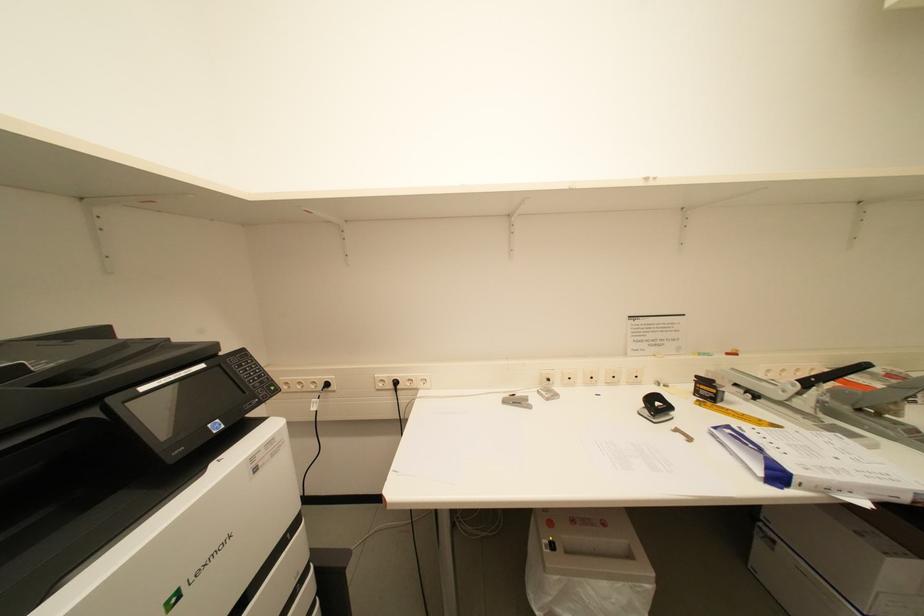
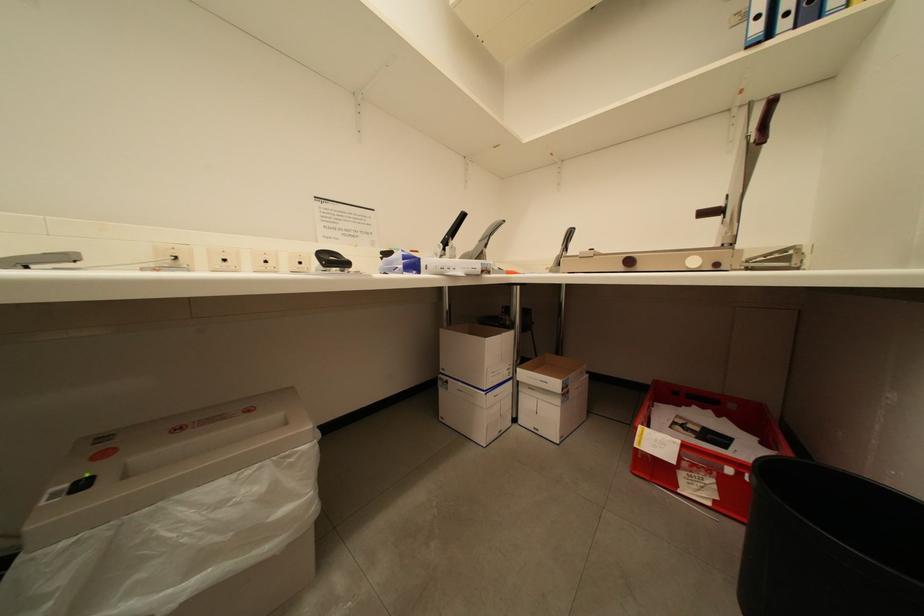
Question: Based on the continuous images, in which direction is the camera rotating? Reply with the corresponding letter.

Choices:
 (A) Left
 (B) Right
 (C) Up
 (D) Down

Answer: (B)